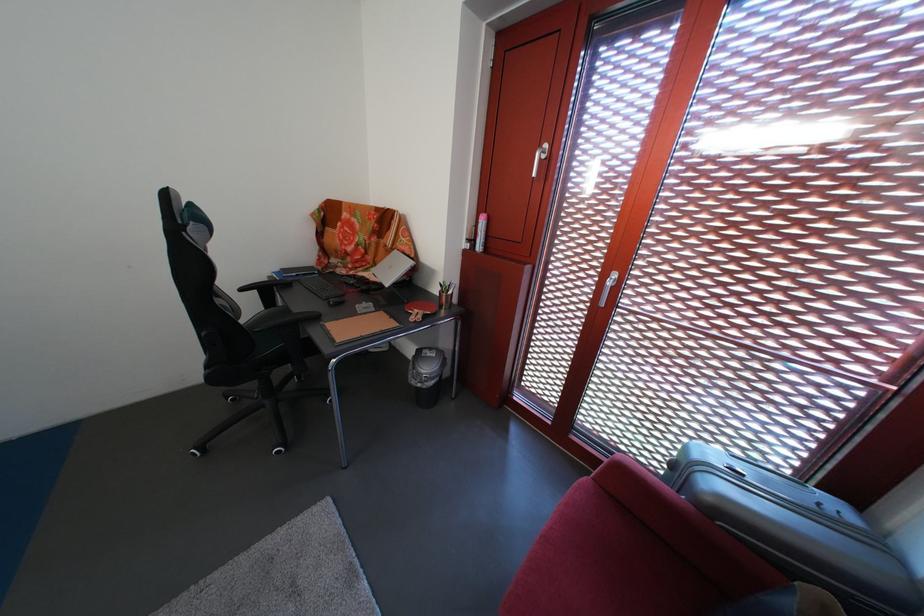
Where would you turn the silver window handle? Please return your answer as a coordinate pair (x, y).

(540, 156)